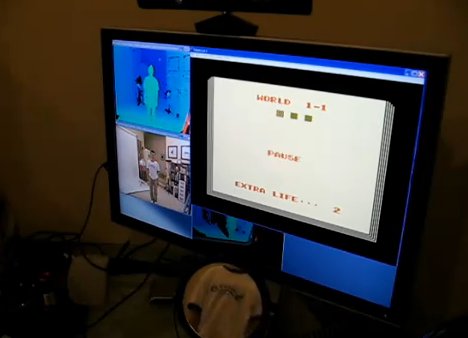
At what (x,y) coordinates should I click in order to perform the action: click on top right hand corner of computer monitor. Please return your answer as a coordinate pair (x, y). Looking at the image, I should click on (445, 58).